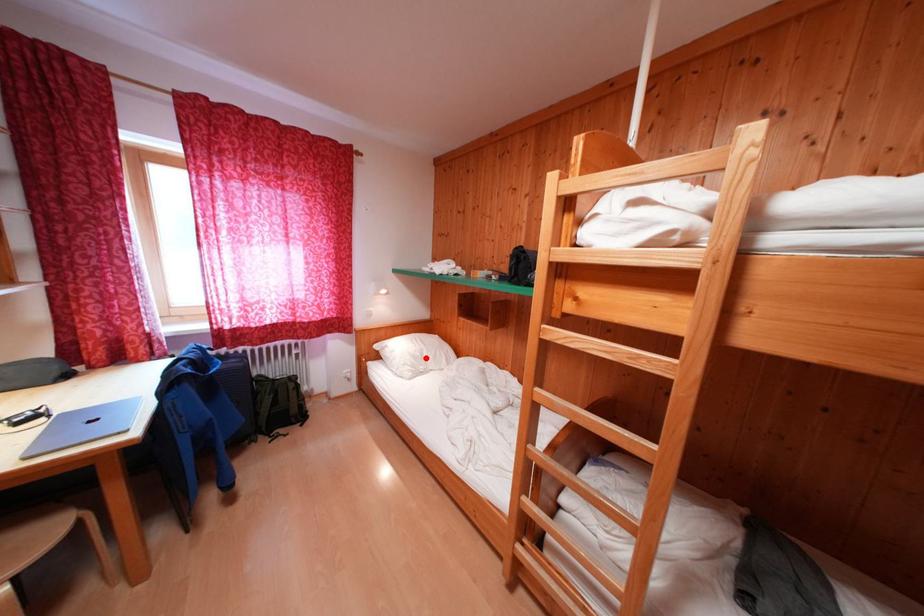
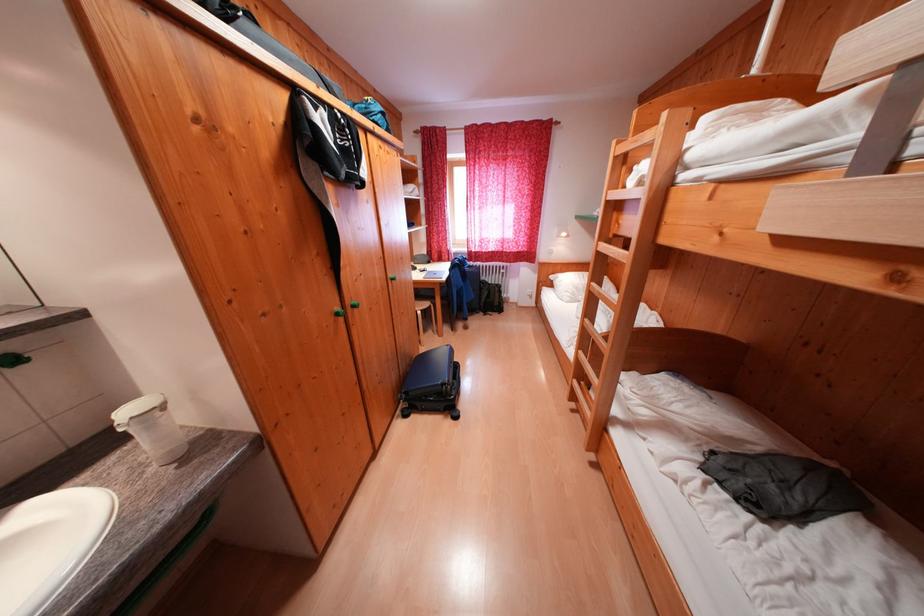
Question: A red point is marked in image1. In image2, is the corresponding 3D point closer to the camera or farther? Reply with the corresponding letter.

Choices:
 (A) The corresponding 3D point is closer.
 (B) The corresponding 3D point is farther.

Answer: (A)